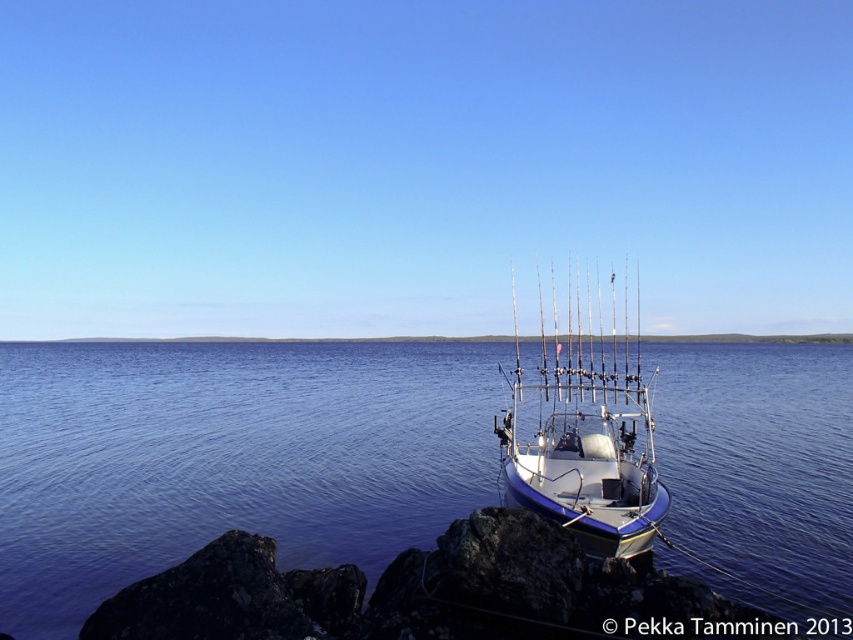
Can you confirm if dark gray rock at lower center is positioned above white glossy boat at center?

Answer: Incorrect, dark gray rock at lower center is not positioned above white glossy boat at center.

You are a GUI agent. You are given a task and a screenshot of the screen. Output one action in this format:
    pyautogui.click(x=<x>, y=<y>)
    Task: Click on the dark gray rock at lower center
    
    Given the screenshot: What is the action you would take?
    pyautogui.click(x=426, y=593)

Locate an element on the screen. blue water at center is located at coordinates (229, 458).

The width and height of the screenshot is (853, 640). In order to click on blue water at center in this screenshot , I will do `click(229, 458)`.

Looking at this image, is blue water at center closer to the viewer compared to white glossy boat at center?

Yes.

Is point (781, 433) positioned before point (605, 417)?

No.

Image resolution: width=853 pixels, height=640 pixels. What are the coordinates of `blue water at center` in the screenshot? It's located at (229, 458).